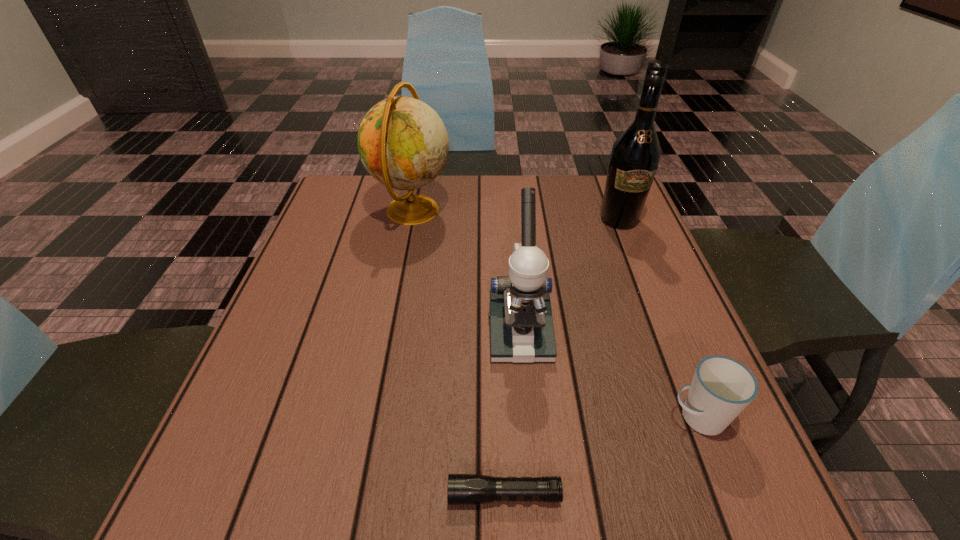
The image size is (960, 540). What are the coordinates of `free space located with a handle on the side of the second shortest object` in the screenshot? It's located at (513, 417).

Locate an element on the screen. Image resolution: width=960 pixels, height=540 pixels. free location located 0.200m with a handle on the side of the second shortest object is located at coordinates (548, 417).

The image size is (960, 540). In order to click on free space located with a handle on the side of the second shortest object in this screenshot , I will do `click(602, 417)`.

Identify the location of vacant area located at the lens end of the flashlight. (x=197, y=495).

At what (x,y) coordinates should I click in order to perform the action: click on free location located 0.110m at the lens end of the flashlight. Please return your answer as a coordinate pair (x, y). Looking at the image, I should click on (374, 495).

Where is `vacant region located 0.060m at the lens end of the flashlight`? This screenshot has width=960, height=540. vacant region located 0.060m at the lens end of the flashlight is located at coordinates (408, 495).

Identify the location of wine bottle at the far edge. The image size is (960, 540). (635, 155).

Where is `globe that is positioned at the far edge`? This screenshot has width=960, height=540. globe that is positioned at the far edge is located at coordinates (403, 143).

The height and width of the screenshot is (540, 960). What are the coordinates of `object at the near edge` in the screenshot? It's located at (463, 489).

Locate an element on the screen. The image size is (960, 540). object present at the left edge is located at coordinates (403, 143).